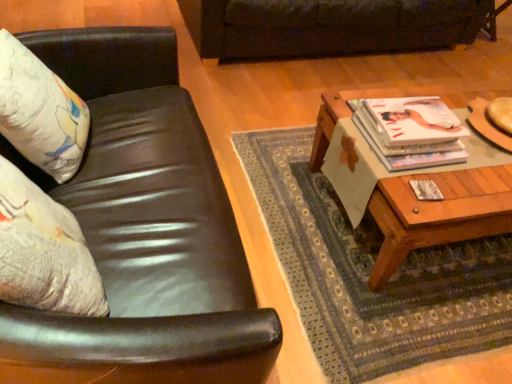
The image size is (512, 384). In order to click on matte white pillow at left in this screenshot , I will do `click(40, 112)`.

What do you see at coordinates (438, 213) in the screenshot?
I see `woodenwoodencoffee table at right` at bounding box center [438, 213].

Measure the distance between point [218,22] and camera.

A distance of 7.62 feet exists between point [218,22] and camera.

Measure the distance between leather couch at upper center, which appears as the second studio couch when ordered from the bottom, and camera.

leather couch at upper center, which appears as the second studio couch when ordered from the bottom, and camera are 2.24 meters apart from each other.

Where is `matte white pillow at left`? The image size is (512, 384). matte white pillow at left is located at coordinates (40, 112).

Considering the sizes of objects matte white pillow at left and white glossy magazine at upper right in the image provided, who is smaller, matte white pillow at left or white glossy magazine at upper right?

white glossy magazine at upper right.

From the image's perspective, between matte white pillow at left and white glossy magazine at upper right, who is located below?

white glossy magazine at upper right.

This screenshot has width=512, height=384. I want to click on pillow located above the white glossy magazine at upper right (from the image's perspective), so click(40, 112).

Looking at this image, are matte white pillow at left and white glossy magazine at upper right far apart?

Yes, matte white pillow at left and white glossy magazine at upper right are located far from each other.

Measure the distance from white glossy magazine at upper right to matte white pillow at left.

The distance of white glossy magazine at upper right from matte white pillow at left is 3.42 feet.

From the image's perspective, between white glossy magazine at upper right and matte white pillow at left, who is located below?

white glossy magazine at upper right.

From a real-world perspective, is white glossy magazine at upper right physically below matte white pillow at left?

Indeed, from a real-world perspective, white glossy magazine at upper right is positioned beneath matte white pillow at left.

How different are the orientations of leather couch at upper center, which appears as the second studio couch when viewed from the front, and white glossy magazine at upper right in degrees?

178 degrees separate the facing orientations of leather couch at upper center, which appears as the second studio couch when viewed from the front, and white glossy magazine at upper right.

Is leather couch at upper center, which ranks as the 1th studio couch in top-to-bottom order, facing away from white glossy magazine at upper right?

No.

Is point (317, 42) behind point (438, 99)?

That is True.

Is leather couch at upper center, which appears as the second studio couch when viewed from the front, next to white glossy magazine at upper right and touching it?

No, leather couch at upper center, which appears as the second studio couch when viewed from the front, is not with white glossy magazine at upper right.

Is point (167, 56) positioned in front of point (286, 5)?

Yes.

From the picture: Are black leather couch at left, acting as the 1th studio couch starting from the front, and leather couch at upper center, which is the 1th studio couch in back-to-front order, making contact?

No, black leather couch at left, acting as the 1th studio couch starting from the front, is not next to leather couch at upper center, which is the 1th studio couch in back-to-front order.

The width and height of the screenshot is (512, 384). Find the location of `studio couch located above the black leather couch at left, which appears as the 2th studio couch when viewed from the top (from the image's perspective)`. studio couch located above the black leather couch at left, which appears as the 2th studio couch when viewed from the top (from the image's perspective) is located at coordinates (329, 26).

Is matte white pillow at left next to woodenwoodencoffee table at right and touching it?

matte white pillow at left is not next to woodenwoodencoffee table at right, and they're not touching.

From a real-world perspective, which is physically above, matte white pillow at left or woodenwoodencoffee table at right?

matte white pillow at left.

Which of these two, matte white pillow at left or woodenwoodencoffee table at right, is wider?

With larger width is woodenwoodencoffee table at right.

Is matte white pillow at left facing towards woodenwoodencoffee table at right?

Yes, matte white pillow at left is turned towards woodenwoodencoffee table at right.

Does woodenwoodencoffee table at right have a smaller size compared to leather couch at upper center, which is the 1th studio couch in back-to-front order?

Yes, woodenwoodencoffee table at right is smaller than leather couch at upper center, which is the 1th studio couch in back-to-front order.

From the image's perspective, is woodenwoodencoffee table at right below leather couch at upper center, which appears as the second studio couch when ordered from the bottom?

Correct, woodenwoodencoffee table at right appears lower than leather couch at upper center, which appears as the second studio couch when ordered from the bottom, in the image.

Is woodenwoodencoffee table at right placed right next to leather couch at upper center, which appears as the second studio couch when viewed from the front?

No, woodenwoodencoffee table at right is not next to leather couch at upper center, which appears as the second studio couch when viewed from the front.

Is woodenwoodencoffee table at right aimed at leather couch at upper center, which is the 1th studio couch in back-to-front order?

No, woodenwoodencoffee table at right is not oriented towards leather couch at upper center, which is the 1th studio couch in back-to-front order.

From the image's perspective, is leather couch at upper center, which ranks as the 1th studio couch in top-to-bottom order, on matte white pillow at left?

Correct, leather couch at upper center, which ranks as the 1th studio couch in top-to-bottom order, appears higher than matte white pillow at left in the image.

How far apart are leather couch at upper center, which is the 1th studio couch in back-to-front order, and matte white pillow at left?

leather couch at upper center, which is the 1th studio couch in back-to-front order, is 1.42 meters away from matte white pillow at left.

Is the position of leather couch at upper center, which appears as the second studio couch when viewed from the front, less distant than that of matte white pillow at left?

No, leather couch at upper center, which appears as the second studio couch when viewed from the front, is further to the viewer.

Considering the positions of point (389, 2) and point (60, 172), is point (389, 2) closer or farther from the camera than point (60, 172)?

Point (389, 2) is positioned farther from the camera compared to point (60, 172).

Where is `magazine directly beneath the matte white pillow at left (from a real-world perspective)`? This screenshot has height=384, width=512. magazine directly beneath the matte white pillow at left (from a real-world perspective) is located at coordinates (411, 131).

The image size is (512, 384). I want to click on pillow lying above the white glossy magazine at upper right (from the image's perspective), so click(40, 112).

Looking at this image, looking at the image, which one is located closer to woodenwoodencoffee table at right, leather couch at upper center, which ranks as the 1th studio couch in top-to-bottom order, or matte white pillow at left?

The object closer to woodenwoodencoffee table at right is matte white pillow at left.

From the image, which object appears to be farther from white glossy magazine at upper right, woodenwoodencoffee table at right or matte white pillow at left?

matte white pillow at left is positioned further to the anchor white glossy magazine at upper right.

When comparing their distances from leather couch at upper center, which ranks as the 1th studio couch in top-to-bottom order, does matte white pillow at left or white glossy magazine at upper right seem further?

matte white pillow at left is positioned further to the anchor leather couch at upper center, which ranks as the 1th studio couch in top-to-bottom order.

Which object lies further to the anchor point black leather couch at left, which appears as the 1th studio couch when ordered from the bottom, white glossy magazine at upper right or matte white pillow at left?

white glossy magazine at upper right lies further to black leather couch at left, which appears as the 1th studio couch when ordered from the bottom, than the other object.

Which object lies nearer to the anchor point leather couch at upper center, which is the 1th studio couch in back-to-front order, white glossy magazine at upper right or woodenwoodencoffee table at right?

white glossy magazine at upper right lies closer to leather couch at upper center, which is the 1th studio couch in back-to-front order, than the other object.

Based on their spatial positions, is leather couch at upper center, which ranks as the 1th studio couch in top-to-bottom order, or woodenwoodencoffee table at right further from matte white pillow at left?

Among the two, leather couch at upper center, which ranks as the 1th studio couch in top-to-bottom order, is located further to matte white pillow at left.

Based on the photo, which object lies nearer to the anchor point matte white pillow at left, white glossy magazine at upper right or leather couch at upper center, which appears as the second studio couch when viewed from the front?

The object closer to matte white pillow at left is white glossy magazine at upper right.

Estimate the real-world distances between objects in this image. Which object is closer to white glossy magazine at upper right, matte white pillow at left or black leather couch at left, which appears as the 2th studio couch when viewed from the top?

Among the two, black leather couch at left, which appears as the 2th studio couch when viewed from the top, is located nearer to white glossy magazine at upper right.

You are a GUI agent. You are given a task and a screenshot of the screen. Output one action in this format:
    pyautogui.click(x=<x>, y=<y>)
    Task: Click on the coffee table between black leather couch at left, acting as the 1th studio couch starting from the front, and leather couch at upper center, which ranks as the 1th studio couch in top-to-bottom order, from front to back
    The image size is (512, 384).
    Given the screenshot: What is the action you would take?
    pyautogui.click(x=438, y=213)

Find the location of a particular element. This screenshot has width=512, height=384. magazine between leather couch at upper center, which is the 1th studio couch in back-to-front order, and woodenwoodencoffee table at right from top to bottom is located at coordinates (411, 131).

You are a GUI agent. You are given a task and a screenshot of the screen. Output one action in this format:
    pyautogui.click(x=<x>, y=<y>)
    Task: Click on the magazine between black leather couch at left, acting as the 1th studio couch starting from the front, and leather couch at upper center, which appears as the second studio couch when viewed from the front, along the z-axis
    This screenshot has width=512, height=384.
    Given the screenshot: What is the action you would take?
    pyautogui.click(x=411, y=131)

Identify the location of magazine situated between matte white pillow at left and woodenwoodencoffee table at right from left to right. The image size is (512, 384). tap(411, 131).